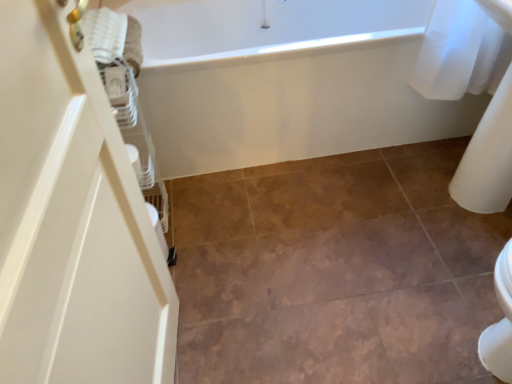
Question: Does brown matte tile at center have a lesser height compared to white textured towel at upper left?

Choices:
 (A) no
 (B) yes

Answer: (B)

Question: Can you confirm if brown matte tile at center is smaller than white textured towel at upper left?

Choices:
 (A) no
 (B) yes

Answer: (A)

Question: Is brown matte tile at center oriented towards white textured towel at upper left?

Choices:
 (A) no
 (B) yes

Answer: (A)

Question: Is white textured towel at upper left surrounded by brown matte tile at center?

Choices:
 (A) yes
 (B) no

Answer: (B)

Question: Is brown matte tile at center positioned with its back to white textured towel at upper left?

Choices:
 (A) yes
 (B) no

Answer: (B)

Question: Can you confirm if brown matte tile at center is positioned to the left of white textured towel at upper left?

Choices:
 (A) no
 (B) yes

Answer: (A)

Question: Does white textured towel at upper left have a greater width compared to brown matte tile at center?

Choices:
 (A) no
 (B) yes

Answer: (A)

Question: Is white textured towel at upper left further to the viewer compared to brown matte tile at center?

Choices:
 (A) yes
 (B) no

Answer: (A)

Question: From the image's perspective, is white textured towel at upper left located above brown matte tile at center?

Choices:
 (A) no
 (B) yes

Answer: (B)

Question: Is white textured towel at upper left bigger than brown matte tile at center?

Choices:
 (A) yes
 (B) no

Answer: (B)

Question: From a real-world perspective, is white textured towel at upper left beneath brown matte tile at center?

Choices:
 (A) no
 (B) yes

Answer: (A)

Question: Is white textured towel at upper left looking in the opposite direction of brown matte tile at center?

Choices:
 (A) yes
 (B) no

Answer: (B)

Question: Does white glossy bathtub at upper center turn towards brown matte tile at center?

Choices:
 (A) yes
 (B) no

Answer: (A)